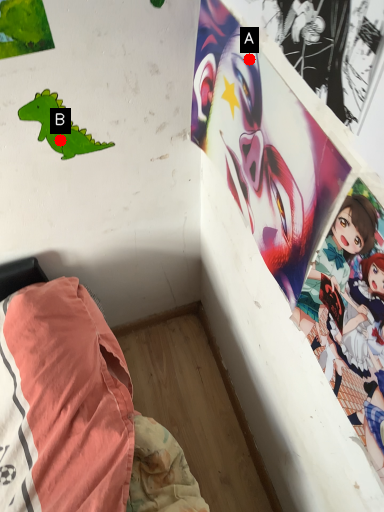
Question: Two points are circled on the image, labeled by A and B beside each circle. Which point is closer to the camera?

Choices:
 (A) A is closer
 (B) B is closer

Answer: (A)